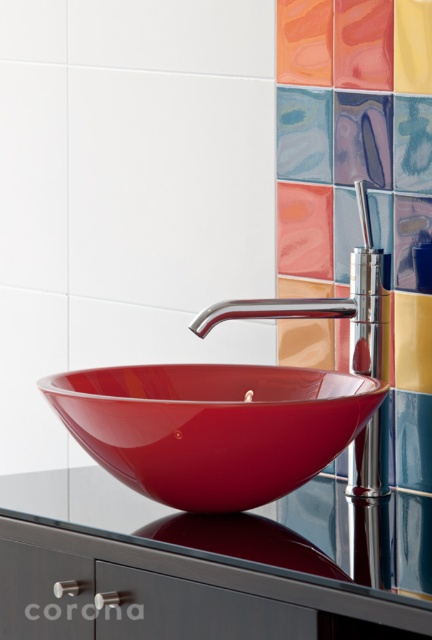
You are designing a bathroom layout and need to ensure that the glossy glass bowl at center and the chrome metallic faucet at center are placed in a way that allows for easy access to both. Considering their sizes, which object should be positioned closer to the user for optimal accessibility?

The chrome metallic faucet at center should be positioned closer to the user because it is smaller in size compared to the glossy glass bowl at center, allowing for easier access without obstruction.

You are standing in the bathroom and want to place a decorative item on the glossy glass counter at center. Based on its position, where should you aim to place the item to ensure it lands correctly?

The glossy glass counter at center is located at the 2D coordinates point (209, 566), so you should aim for that specific point to place the decorative item accurately.

You are designing a bathroom layout and need to place a decorative item on the glossy glass counter at center. Considering the size of the orange glossy tile at upper center, will the counter have enough space for the item?

The glossy glass counter at center is bigger than the orange glossy tile at upper center, so it has enough space to place the decorative item.